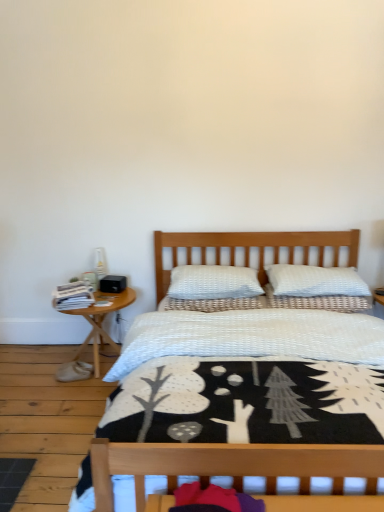
Question: Is the depth of white textured bed at center less than that of white textured pillow at upper center, acting as the third pillow starting from the left?

Choices:
 (A) no
 (B) yes

Answer: (B)

Question: Considering the relative sizes of white textured bed at center and white textured pillow at upper center, acting as the third pillow starting from the left, in the image provided, is white textured bed at center smaller than white textured pillow at upper center, acting as the third pillow starting from the left,?

Choices:
 (A) yes
 (B) no

Answer: (B)

Question: From the image's perspective, would you say white textured bed at center is positioned over white textured pillow at upper center, which is counted as the 1th pillow, starting from the right?

Choices:
 (A) yes
 (B) no

Answer: (B)

Question: From a real-world perspective, is white textured bed at center located beneath white textured pillow at upper center, which is counted as the 1th pillow, starting from the right?

Choices:
 (A) yes
 (B) no

Answer: (A)

Question: Is white textured bed at center wider than white textured pillow at upper center, acting as the third pillow starting from the left?

Choices:
 (A) no
 (B) yes

Answer: (B)

Question: Is point (266, 292) positioned closer to the camera than point (289, 291)?

Choices:
 (A) closer
 (B) farther

Answer: (B)

Question: Based on their sizes in the image, would you say white textured pillow at center, which is the second pillow in left-to-right order, is bigger or smaller than white textured pillow at upper center, which is counted as the 1th pillow, starting from the right?

Choices:
 (A) small
 (B) big

Answer: (A)

Question: From the image's perspective, relative to white textured pillow at upper center, which is counted as the 1th pillow, starting from the right, is white textured pillow at center, the 2th pillow from the right, above or below?

Choices:
 (A) below
 (B) above

Answer: (A)

Question: Visually, is white textured pillow at center, which is the second pillow in left-to-right order, positioned to the left or to the right of white textured pillow at upper center, acting as the third pillow starting from the left?

Choices:
 (A) right
 (B) left

Answer: (B)

Question: Choose the correct answer: Is white textured bed at center inside white textured pillow at center, the first pillow when ordered from left to right, or outside it?

Choices:
 (A) inside
 (B) outside

Answer: (B)

Question: Is white textured bed at center to the left or to the right of white textured pillow at center, the third pillow viewed from the right, in the image?

Choices:
 (A) left
 (B) right

Answer: (B)

Question: From the image's perspective, is white textured bed at center located above or below white textured pillow at center, the first pillow when ordered from left to right?

Choices:
 (A) below
 (B) above

Answer: (A)

Question: Relative to white textured pillow at center, the third pillow viewed from the right, is white textured bed at center in front or behind?

Choices:
 (A) behind
 (B) front

Answer: (B)

Question: Is point (96, 300) closer or farther from the camera than point (317, 295)?

Choices:
 (A) farther
 (B) closer

Answer: (A)

Question: Do you think woodennightstand at left is within white textured pillow at center, which is the second pillow in left-to-right order, or outside of it?

Choices:
 (A) outside
 (B) inside

Answer: (A)